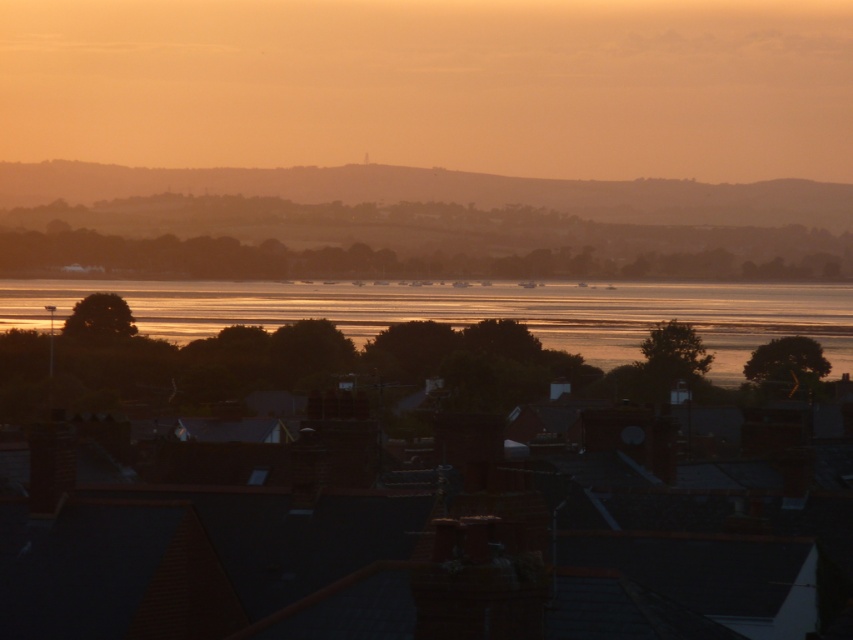
Question: Which point is closer to the camera taking this photo?

Choices:
 (A) (679, 246)
 (B) (310, 301)

Answer: (B)

Question: Where is silvery metallic water at center located in relation to shiny metallic water at center in the image?

Choices:
 (A) left
 (B) right

Answer: (B)

Question: Among these points, which one is farthest from the camera?

Choices:
 (A) (711, 220)
 (B) (51, 304)

Answer: (A)

Question: Is silvery metallic water at center below shiny metallic water at center?

Choices:
 (A) no
 (B) yes

Answer: (A)

Question: Does silvery metallic water at center appear on the right side of shiny metallic water at center?

Choices:
 (A) yes
 (B) no

Answer: (A)